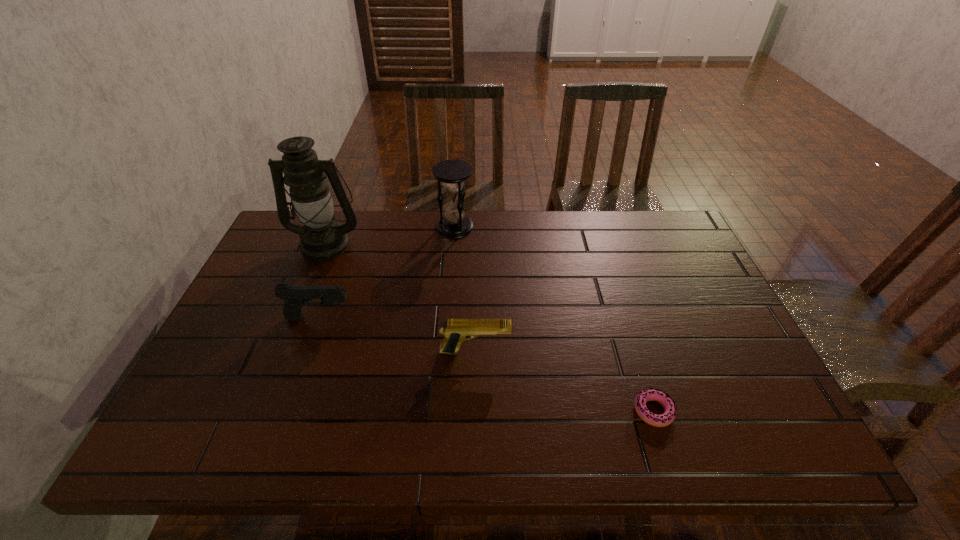
Locate an element on the screen. This screenshot has width=960, height=540. free space at the near edge is located at coordinates pyautogui.click(x=597, y=448).

Locate an element on the screen. The image size is (960, 540). vacant space at the left edge is located at coordinates (270, 268).

Find the location of a particular element. The height and width of the screenshot is (540, 960). vacant region at the right edge of the desktop is located at coordinates (726, 342).

Image resolution: width=960 pixels, height=540 pixels. Find the location of `free location at the far right corner of the desktop`. free location at the far right corner of the desktop is located at coordinates (642, 217).

At what (x,y) coordinates should I click in order to perform the action: click on vacant area between the second nearest object and the left pistol. Please return your answer as a coordinate pair (x, y). Looking at the image, I should click on (397, 335).

Identify the location of free space between the third farthest object and the right pistol. The height and width of the screenshot is (540, 960). [397, 335].

This screenshot has width=960, height=540. Identify the location of vacant area between the nearer pistol and the third farthest object. (397, 335).

The width and height of the screenshot is (960, 540). What are the coordinates of `free area in between the hourglass and the left pistol` in the screenshot? It's located at (387, 273).

Find the location of a particular element. blank region between the second tallest object and the shortest object is located at coordinates (554, 319).

Locate an element on the screen. The image size is (960, 540). vacant region between the fourth farthest object and the farther pistol is located at coordinates (397, 335).